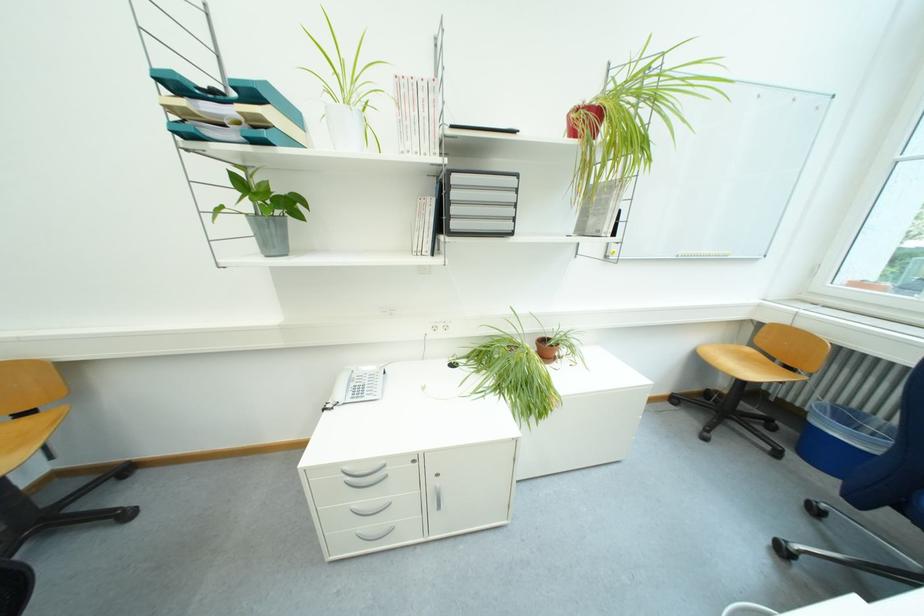
Locate an element on the screen. Image resolution: width=924 pixels, height=616 pixels. telephone handset is located at coordinates (363, 386).